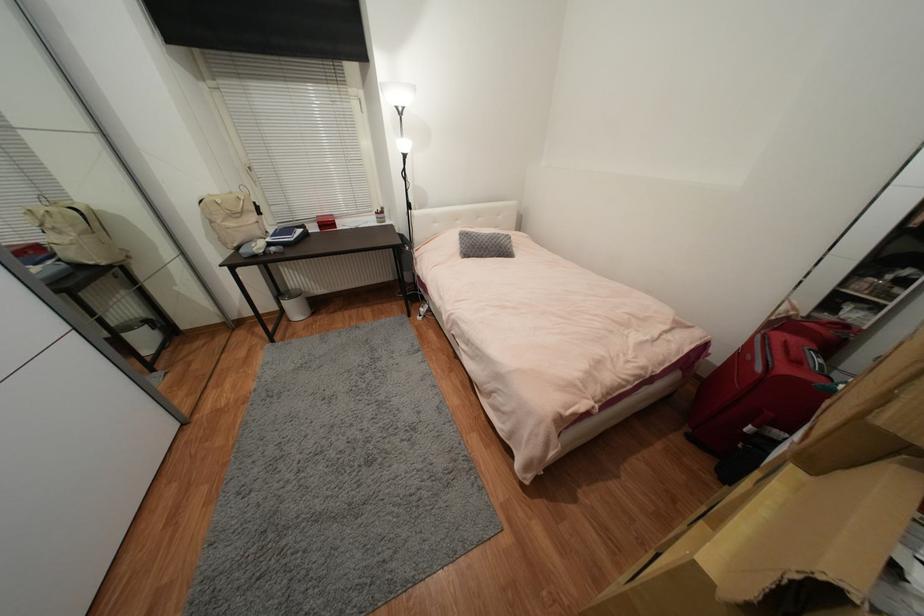
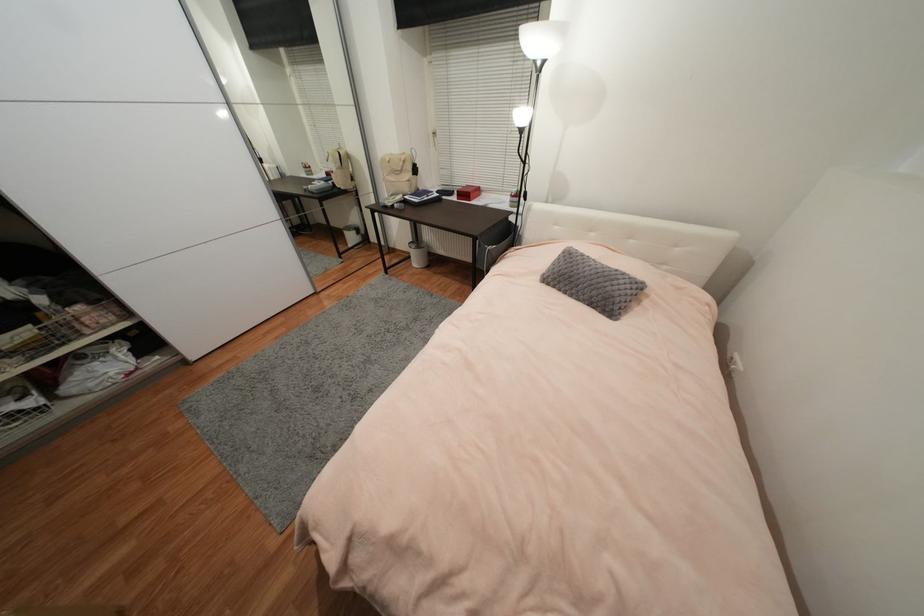
Find the pixel in the second image that matches the point at 487,257 in the first image.

(569, 294)